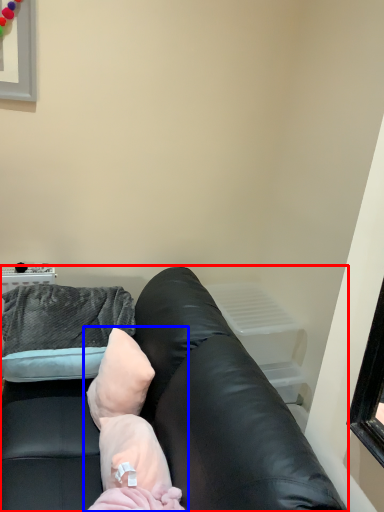
Question: Which object appears farthest to the camera in this image, studio couch (highlighted by a red box) or newborn (highlighted by a blue box)?

Choices:
 (A) studio couch
 (B) newborn

Answer: (B)